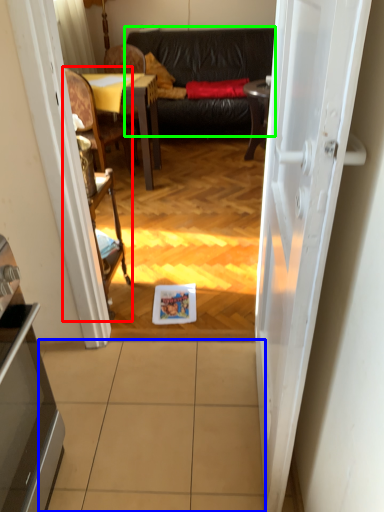
Question: Based on their relative distances, which object is farther from armchair (highlighted by a red box)? Choose from tile (highlighted by a blue box) and studio couch (highlighted by a green box).

Choices:
 (A) tile
 (B) studio couch

Answer: (B)